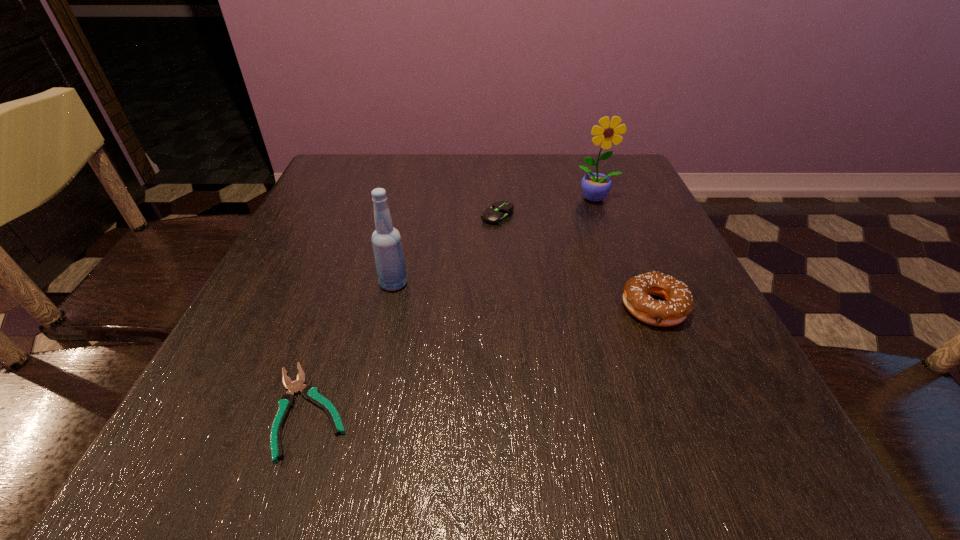
You are a GUI agent. You are given a task and a screenshot of the screen. Output one action in this format:
    pyautogui.click(x=<x>, y=<y>)
    Task: Click on the vacant space at the near edge of the desktop
    This screenshot has width=960, height=540.
    Given the screenshot: What is the action you would take?
    pyautogui.click(x=475, y=423)

Locate an element on the screen. Image resolution: width=960 pixels, height=540 pixels. free space at the left edge of the desktop is located at coordinates (260, 315).

You are a GUI agent. You are given a task and a screenshot of the screen. Output one action in this format:
    pyautogui.click(x=<x>, y=<y>)
    Task: Click on the free space at the far left corner of the desktop
    
    Given the screenshot: What is the action you would take?
    pyautogui.click(x=364, y=177)

This screenshot has width=960, height=540. What are the coordinates of `vacant space at the near right corner of the desktop` in the screenshot? It's located at (683, 475).

I want to click on empty space that is in between the sunflower and the third shortest object, so click(625, 253).

At what (x,y) coordinates should I click in order to perform the action: click on vacant point located between the sunflower and the shortest object. Please return your answer as a coordinate pair (x, y). The image size is (960, 540). Looking at the image, I should click on (453, 304).

Find the location of `free area in between the third object from right to left and the sunflower`. free area in between the third object from right to left and the sunflower is located at coordinates (547, 207).

This screenshot has height=540, width=960. Find the location of `free area in between the bottle and the shortest object`. free area in between the bottle and the shortest object is located at coordinates point(351,347).

Find the location of a particular element. vacant point located between the bottle and the sunflower is located at coordinates (495, 241).

The width and height of the screenshot is (960, 540). I want to click on empty location between the shortest object and the bottle, so click(x=351, y=347).